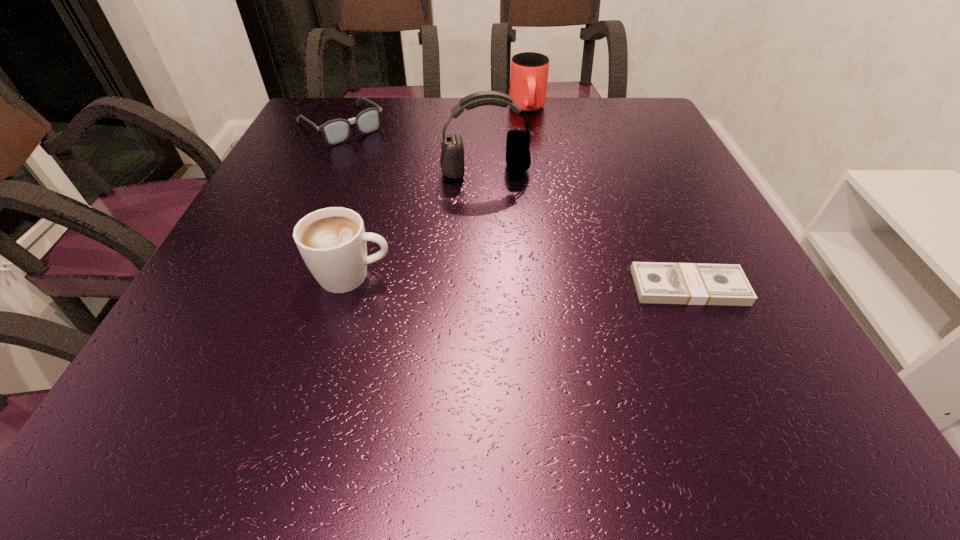
At what (x,y) coordinates should I click in order to perform the action: click on free space located 0.370m on the handle side of the cup. Please return your answer as a coordinate pair (x, y). This screenshot has height=540, width=960. Looking at the image, I should click on click(x=543, y=205).

The height and width of the screenshot is (540, 960). What are the coordinates of `vacant space positioned on the handle side of the cup` in the screenshot? It's located at (531, 130).

At what (x,y) coordinates should I click in order to perform the action: click on vacant point located on the headband of the headset. Please return your answer as a coordinate pair (x, y). Image resolution: width=960 pixels, height=540 pixels. Looking at the image, I should click on (497, 197).

The height and width of the screenshot is (540, 960). I want to click on vacant space situated on the headband of the headset, so click(520, 275).

The image size is (960, 540). In order to click on free region located on the headband of the headset in this screenshot , I will do `click(502, 214)`.

Locate an element on the screen. free space located 0.240m on the face of the spectacles is located at coordinates (410, 188).

Find the location of a particular element. vacant space located 0.110m on the face of the spectacles is located at coordinates (382, 163).

In order to click on vacant space located 0.180m on the face of the spectacles in this screenshot , I will do `click(396, 176)`.

Identify the location of cup that is at the far edge. (529, 71).

In order to click on spectacles located in the far edge section of the desktop in this screenshot , I will do pyautogui.click(x=335, y=131).